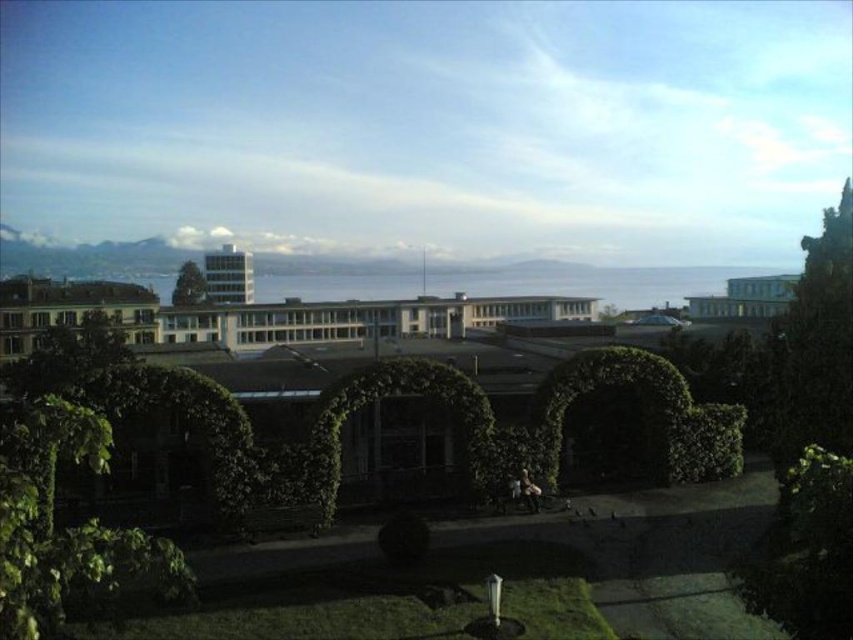
Please look at the image. There is a point at coordinates (814, 348). Can you tell me what object is located at that point?

The green leafy tree at right is located at point (814, 348).

What is the 2D coordinate of the green leafy tree at right in the image?

The 2D coordinate of the green leafy tree at right is at point (814, 348).